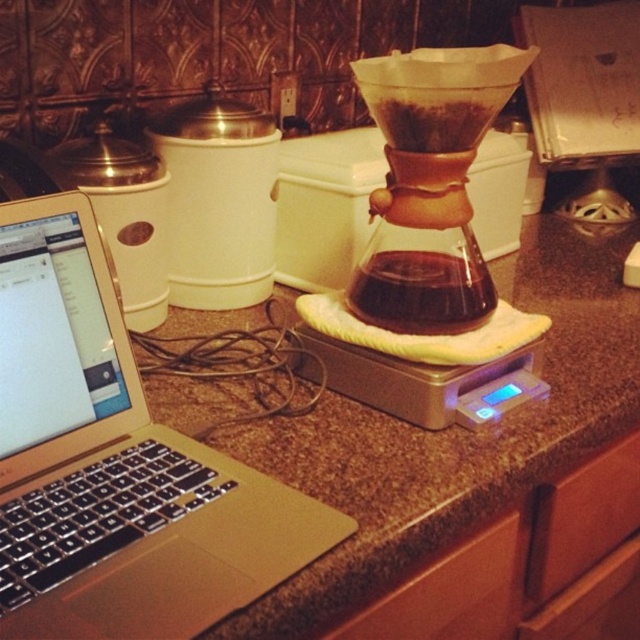
Question: Which point appears farthest from the camera in this image?

Choices:
 (A) (636, 516)
 (B) (385, 284)
 (C) (4, 548)

Answer: (A)

Question: From the image, what is the correct spatial relationship of brown wood drawer at lower right in relation to dark brown liquid at center?

Choices:
 (A) above
 (B) below

Answer: (B)

Question: Which point is farther from the camera taking this photo?

Choices:
 (A) (429, 301)
 (B) (570, 529)
 (C) (419, 580)

Answer: (B)

Question: Can you confirm if gold metallic laptop at left is smaller than transparent glass carafe at center?

Choices:
 (A) yes
 (B) no

Answer: (A)

Question: Among these points, which one is farthest from the camera?

Choices:
 (A) (557, 564)
 (B) (364, 296)
 (C) (35, 285)
 (D) (506, 621)

Answer: (A)

Question: Is brown wood drawer at lower center behind brown wood drawer at lower right?

Choices:
 (A) yes
 (B) no

Answer: (B)